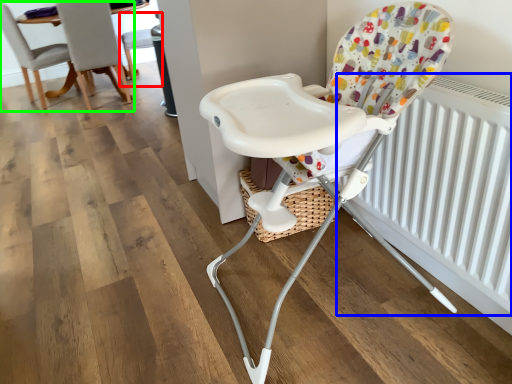
Question: Based on their relative distances, which object is nearer to chair (highlighted by a red box)? Choose from radiator (highlighted by a blue box) and chair (highlighted by a green box).

Choices:
 (A) radiator
 (B) chair

Answer: (B)